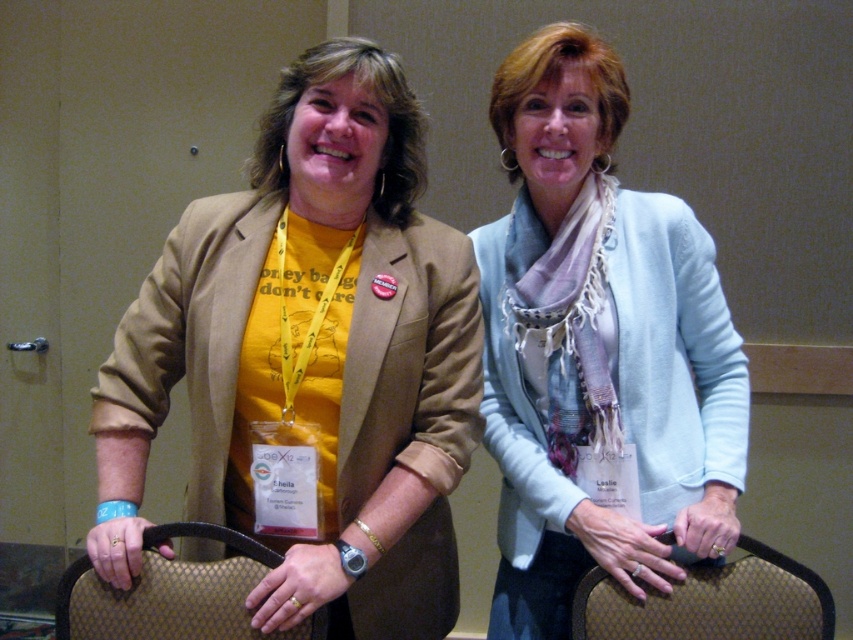
Consider the image. You are a photographer at a conference. You need to position a tripod to capture both the brown textured bag at lower center and the brown textured chair at lower right in the same frame. Based on their positions, which object should you place the tripod closer to in order to include both in the shot?

The brown textured bag at lower center is located above the brown textured chair at lower right, so placing the tripod closer to the brown textured chair at lower right would allow both objects to be captured in the frame.

You are a photographer setting up for a group photo. You need to position the light blue sweater at center so it is visible in the frame. Where should you place the camera relative to the brown textured chair at lower right?

The light blue sweater at center is located above the brown textured chair at lower right, so placing the camera above the brown textured chair at lower right will ensure the light blue sweater at center is visible in the frame.